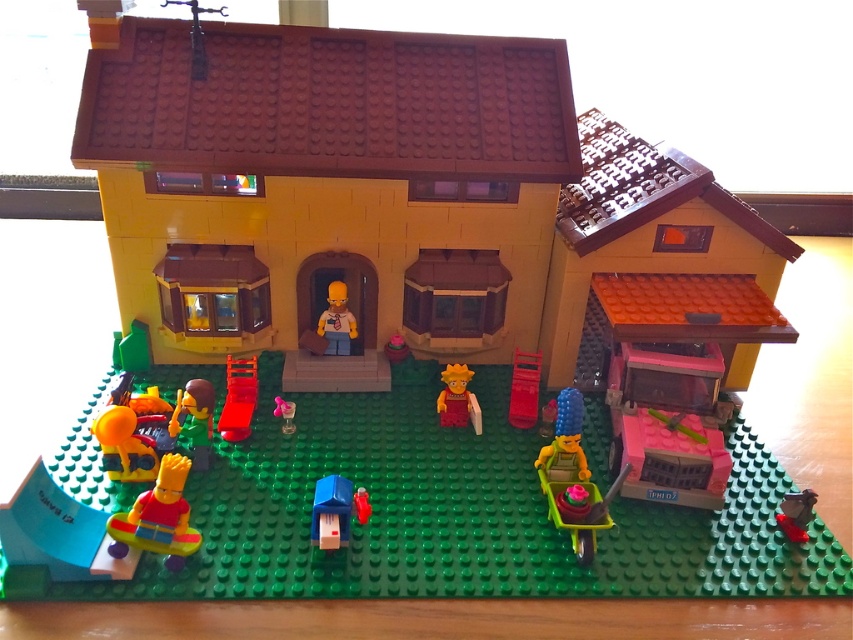
Question: Which point is farther to the camera?

Choices:
 (A) orange matte ball at lower left
 (B) pink plastic cup at center
 (C) matte yellow shirt at center
 (D) metallic silver toy at lower right

Answer: (C)

Question: Is matte green plastic cart at lower right below translucent red toy at center?

Choices:
 (A) no
 (B) yes

Answer: (A)

Question: Does matte red minifigure at center have a smaller size compared to matte pink cupcake at center?

Choices:
 (A) yes
 (B) no

Answer: (B)

Question: Is orange matte ball at lower left bigger than translucent orange plastic watering can at lower center?

Choices:
 (A) no
 (B) yes

Answer: (A)

Question: Among these points, which one is farthest from the camera?

Choices:
 (A) pyautogui.click(x=167, y=467)
 (B) pyautogui.click(x=602, y=518)

Answer: (B)

Question: Estimate the real-world distances between objects in this image. Which object is farther from the orange matte ball at lower left?

Choices:
 (A) matte pink cupcake at center
 (B) pink plastic cup at center
 (C) smooth blue toy at center
 (D) translucent red toy at center

Answer: (A)